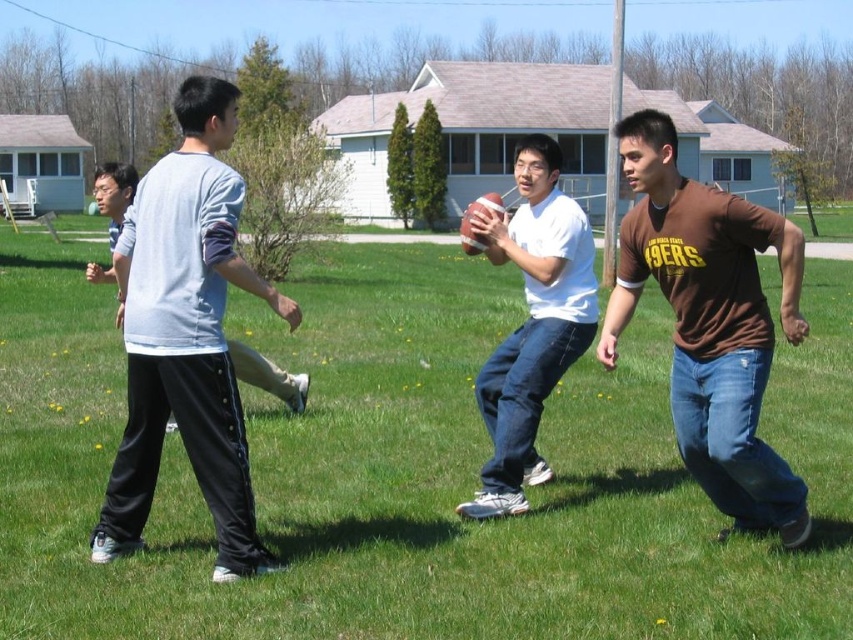
You are a photographer trying to capture a photo of the white matte shirt at center and the green grass at center. Which object is closer to the camera?

The white matte shirt at center is closer to the camera because the green grass at center is positioned under it.